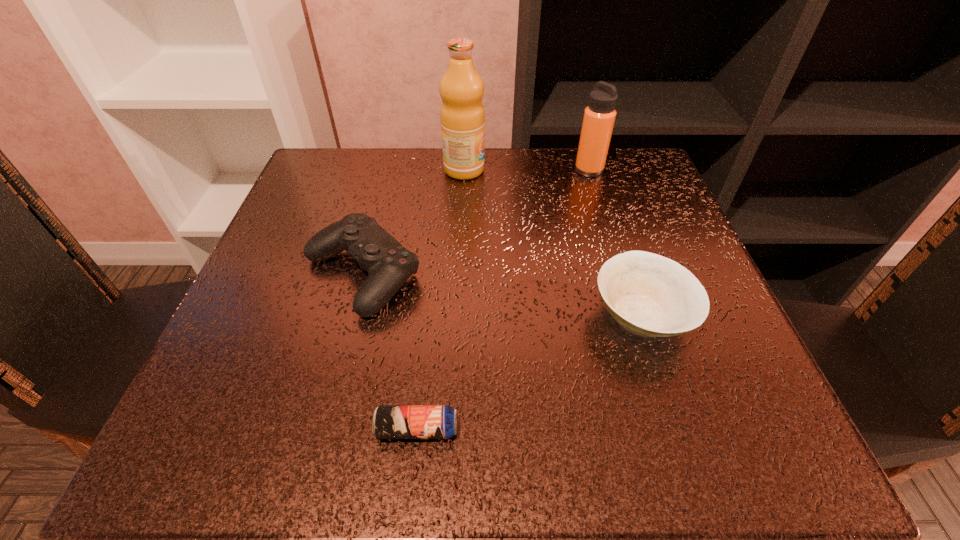
Image resolution: width=960 pixels, height=540 pixels. In order to click on blank area located 0.320m on the right of the beer can in this screenshot , I will do `click(705, 429)`.

Image resolution: width=960 pixels, height=540 pixels. I want to click on fruit juice located in the far edge section of the desktop, so click(x=462, y=116).

Find the location of `thermos bottle present at the far edge`. thermos bottle present at the far edge is located at coordinates (599, 117).

Locate an element on the screen. object at the near edge is located at coordinates (389, 421).

Find the location of `object that is at the left edge`. object that is at the left edge is located at coordinates (389, 264).

Locate an element on the screen. The width and height of the screenshot is (960, 540). thermos bottle located in the right edge section of the desktop is located at coordinates (599, 117).

The height and width of the screenshot is (540, 960). What are the coordinates of `bowl that is at the right edge` in the screenshot? It's located at (648, 294).

At what (x,y) coordinates should I click in order to perform the action: click on object at the far right corner. Please return your answer as a coordinate pair (x, y). Image resolution: width=960 pixels, height=540 pixels. Looking at the image, I should click on (599, 117).

The image size is (960, 540). I want to click on vacant region at the far edge of the desktop, so click(466, 185).

At what (x,y) coordinates should I click in order to perform the action: click on vacant space at the left edge of the desktop. Please return your answer as a coordinate pair (x, y). This screenshot has width=960, height=540. Looking at the image, I should click on (302, 217).